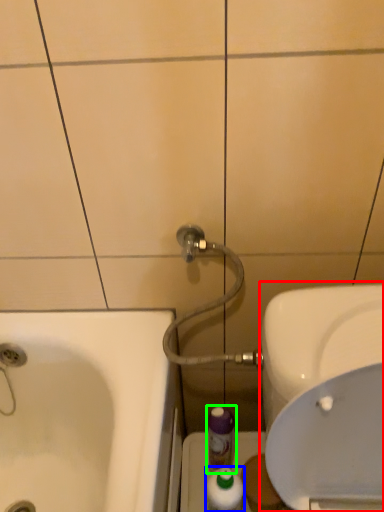
Question: Which object is the closest to the sink (highlighted by a red box)? Choose among these: mouthwash (highlighted by a blue box) or mouthwash (highlighted by a green box).

Choices:
 (A) mouthwash
 (B) mouthwash

Answer: (B)